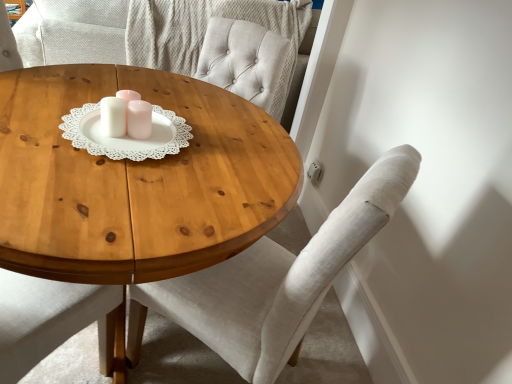
Question: Can light gray fabric chair at center be found inside wooden coffee table at center?

Choices:
 (A) yes
 (B) no

Answer: (A)

Question: From a real-world perspective, is wooden coffee table at center physically above light gray fabric chair at center?

Choices:
 (A) yes
 (B) no

Answer: (B)

Question: Can you confirm if wooden coffee table at center is shorter than light gray fabric chair at center?

Choices:
 (A) no
 (B) yes

Answer: (B)

Question: Is the position of wooden coffee table at center more distant than that of light gray fabric chair at center?

Choices:
 (A) no
 (B) yes

Answer: (A)

Question: Is wooden coffee table at center facing towards light gray fabric chair at center?

Choices:
 (A) yes
 (B) no

Answer: (B)

Question: Does wooden coffee table at center appear on the right side of light gray fabric chair at center?

Choices:
 (A) no
 (B) yes

Answer: (A)

Question: Can you confirm if wooden coffee table at center is positioned to the right of white glossy candle holder at center?

Choices:
 (A) no
 (B) yes

Answer: (A)

Question: Considering the relative sizes of wooden coffee table at center and white glossy candle holder at center in the image provided, is wooden coffee table at center wider than white glossy candle holder at center?

Choices:
 (A) yes
 (B) no

Answer: (A)

Question: From a real-world perspective, does wooden coffee table at center stand above white glossy candle holder at center?

Choices:
 (A) no
 (B) yes

Answer: (A)

Question: Does wooden coffee table at center lie in front of white glossy candle holder at center?

Choices:
 (A) yes
 (B) no

Answer: (A)

Question: Considering the relative sizes of wooden coffee table at center and white glossy candle holder at center in the image provided, is wooden coffee table at center taller than white glossy candle holder at center?

Choices:
 (A) no
 (B) yes

Answer: (B)

Question: Does wooden coffee table at center turn towards white glossy candle holder at center?

Choices:
 (A) yes
 (B) no

Answer: (B)

Question: From a real-world perspective, is light gray fabric chair at center beneath white glossy candle holder at center?

Choices:
 (A) yes
 (B) no

Answer: (A)